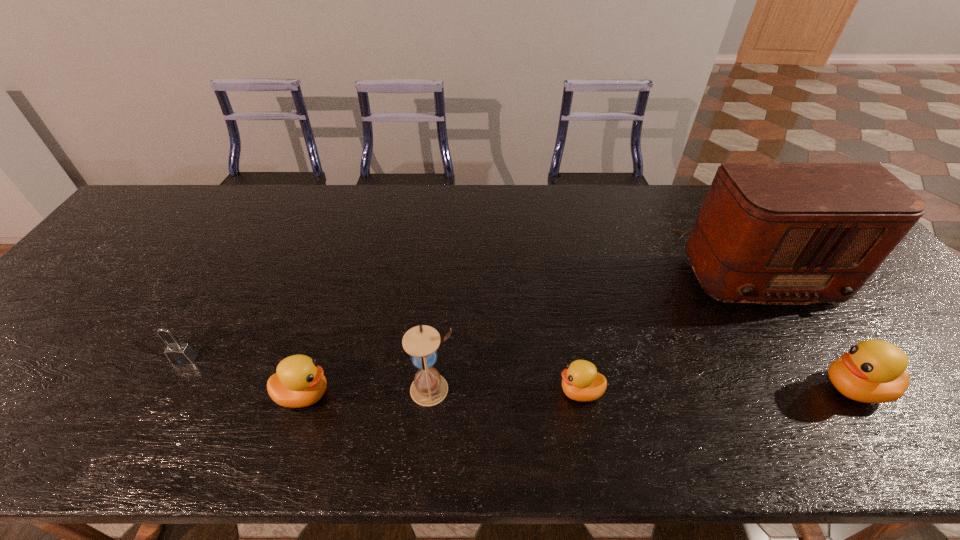
The ducklings are evenly distributed in the image. To maintain this, where would you place another duckling on the left? Please point to a free space. Please provide its 2D coordinates. Your answer should be formatted as a tuple, i.e. [(x, y)], where the tuple contains the x and y coordinates of a point satisfying the conditions above.

[(24, 398)]